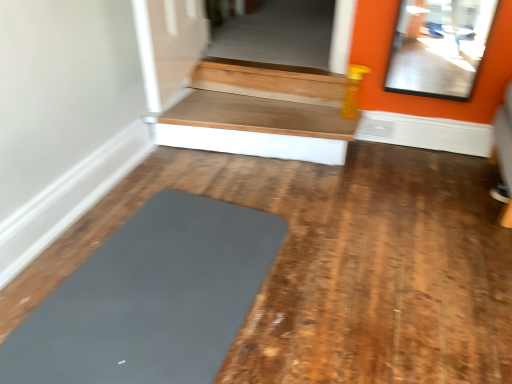
The image size is (512, 384). In order to click on empty space that is ontop of matte gray yoga mat at center (from a real-world perspective) in this screenshot , I will do `click(162, 283)`.